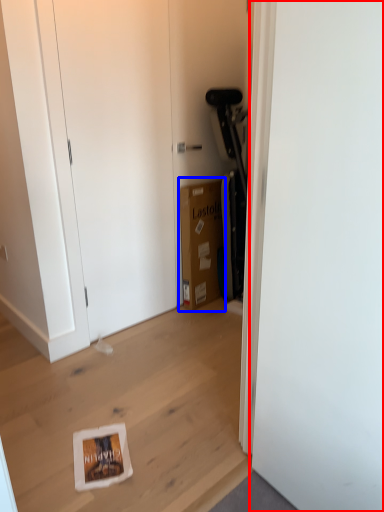
Question: Which object appears closest to the camera in this image, door (highlighted by a red box) or cardboard box (highlighted by a blue box)?

Choices:
 (A) door
 (B) cardboard box

Answer: (A)